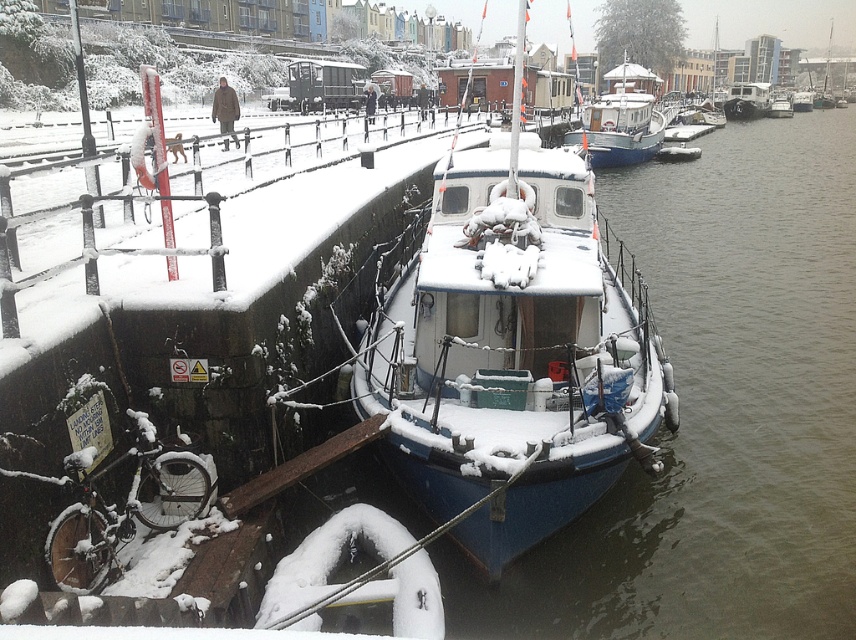
Based on the photo, is blue matte boat at center positioned at the back of white glossy boat at center?

That is False.

Consider the image. Can you confirm if blue matte boat at center is positioned above white glossy boat at center?

No, blue matte boat at center is not above white glossy boat at center.

Is point (497, 419) closer to viewer compared to point (609, 124)?

Yes, point (497, 419) is closer to viewer.

Locate an element on the screen. Image resolution: width=856 pixels, height=640 pixels. blue matte boat at center is located at coordinates (513, 352).